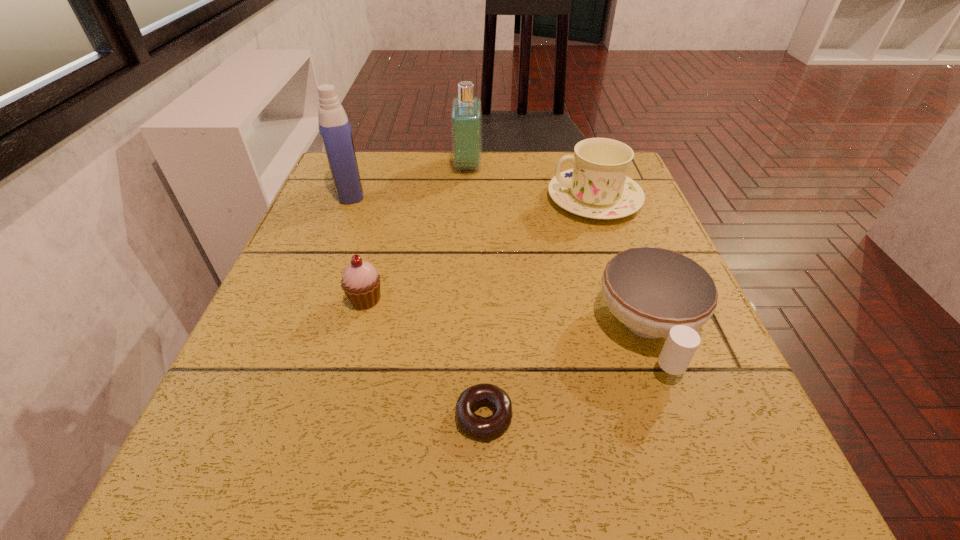
Where is `detergent`? detergent is located at coordinates (334, 126).

At what (x,y) coordinates should I click in order to perform the action: click on the tallest object. Please return your answer as a coordinate pair (x, y). The height and width of the screenshot is (540, 960). Looking at the image, I should click on pyautogui.click(x=334, y=126).

The image size is (960, 540). What are the coordinates of `the second tallest object` in the screenshot? It's located at (466, 113).

You are a GUI agent. You are given a task and a screenshot of the screen. Output one action in this format:
    pyautogui.click(x=<x>, y=<y>)
    Task: Click on the taller chinaware
    
    Given the screenshot: What is the action you would take?
    pyautogui.click(x=597, y=187)

Locate an element on the screen. The image size is (960, 540). the third tallest object is located at coordinates [x=597, y=187].

The image size is (960, 540). Find the location of `cupcake`. cupcake is located at coordinates (360, 282).

This screenshot has width=960, height=540. In order to click on the shorter chinaware in this screenshot , I will do `click(655, 292)`.

In order to click on the nearest object in this screenshot , I will do `click(483, 428)`.

Image resolution: width=960 pixels, height=540 pixels. What are the coordinates of `doughnut` in the screenshot? It's located at (483, 428).

At what (x,y) coordinates should I click in order to perform the action: click on free space located on the back of the leftmost object. Please return your answer as a coordinate pair (x, y). The image size is (960, 540). Looking at the image, I should click on (363, 157).